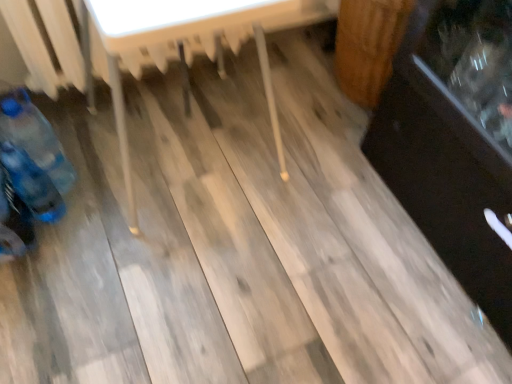
This screenshot has width=512, height=384. I want to click on vacant space that's between wooden table at center and blue plastic bottle at left, marked as the 2th bottle in a bottom-to-top arrangement, so click(x=95, y=190).